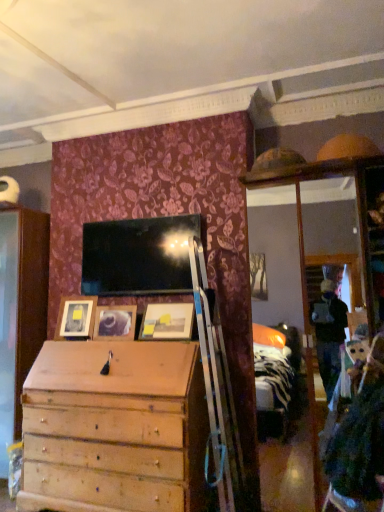
Question: From the image's perspective, is wooden picture frame at center, positioned as the 2th picture frame in right-to-left order, positioned above or below matte wooden picture frame at left, acting as the third picture frame starting from the right?

Choices:
 (A) above
 (B) below

Answer: (B)

Question: Which is correct: wooden picture frame at center, the second picture frame from the left, is inside matte wooden picture frame at left, acting as the third picture frame starting from the right, or outside of it?

Choices:
 (A) outside
 (B) inside

Answer: (A)

Question: Based on their relative distances, which object is farther from the matte wooden picture frame at left, acting as the third picture frame starting from the right?

Choices:
 (A) wooden picture frame at center, the second picture frame from the left
 (B) matte wooden picture frame at center, which is the third picture frame in left-to-right order

Answer: (B)

Question: Considering the real-world distances, which object is farthest from the matte wooden picture frame at center, which is the third picture frame in left-to-right order?

Choices:
 (A) matte wooden picture frame at left, which is counted as the first picture frame, starting from the left
 (B) wooden picture frame at center, the second picture frame from the left

Answer: (A)